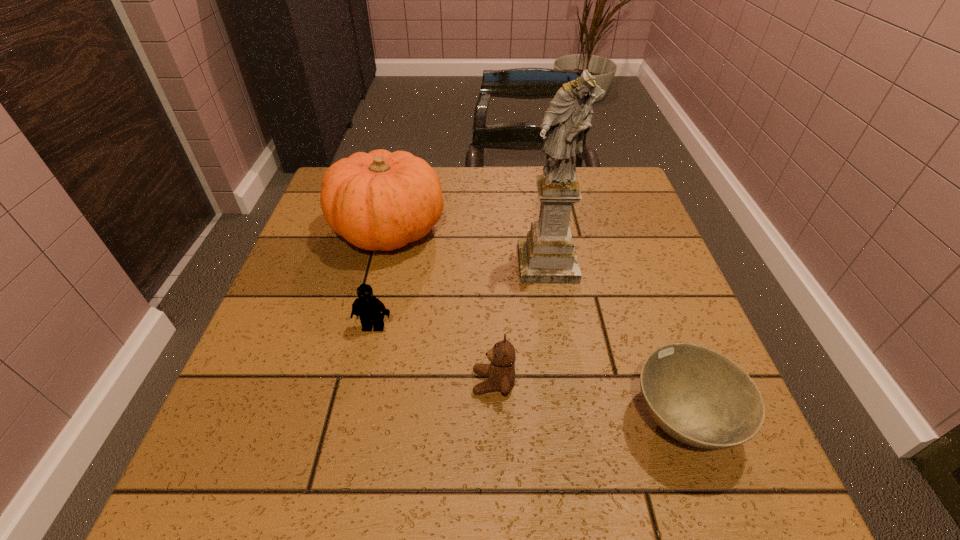
At what (x,y) coordinates should I click in order to perform the action: click on vacant space that satisfies the following two spatial constraints: 1. at the face of the teddy bear; 2. on the left side of the bowl. Please return your answer as a coordinate pair (x, y). The width and height of the screenshot is (960, 540). Looking at the image, I should click on (494, 421).

The height and width of the screenshot is (540, 960). In order to click on vacant space that satisfies the following two spatial constraints: 1. on the front side of the fourth shortest object; 2. on the right side of the shortest object in this screenshot , I will do `click(342, 421)`.

Identify the location of vacant space that satisfies the following two spatial constraints: 1. on the front-facing side of the fourth object from left to right; 2. at the face of the third object from left to right. This screenshot has width=960, height=540. (566, 382).